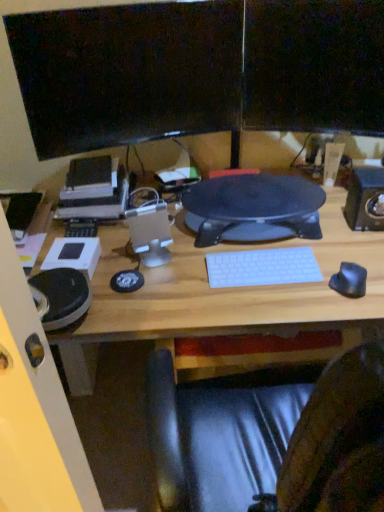
Question: Is black rubber mouse at right bigger than black textured mouse pad at center?

Choices:
 (A) yes
 (B) no

Answer: (B)

Question: Does black rubber mouse at right lie in front of black textured mouse pad at center?

Choices:
 (A) no
 (B) yes

Answer: (B)

Question: Is black rubber mouse at right further to the viewer compared to black textured mouse pad at center?

Choices:
 (A) no
 (B) yes

Answer: (A)

Question: Could you tell me if black rubber mouse at right is facing black textured mouse pad at center?

Choices:
 (A) no
 (B) yes

Answer: (A)

Question: Considering the relative sizes of black rubber mouse at right and black textured mouse pad at center in the image provided, is black rubber mouse at right shorter than black textured mouse pad at center?

Choices:
 (A) no
 (B) yes

Answer: (B)

Question: Considering the relative sizes of black rubber mouse at right and black textured mouse pad at center in the image provided, is black rubber mouse at right thinner than black textured mouse pad at center?

Choices:
 (A) yes
 (B) no

Answer: (A)

Question: Is black textured mouse pad at center further to camera compared to matte black monitor at upper center, the 1th computer monitor in the right-to-left sequence?

Choices:
 (A) no
 (B) yes

Answer: (B)

Question: Is black textured mouse pad at center next to matte black monitor at upper center, the second computer monitor when ordered from left to right, and touching it?

Choices:
 (A) no
 (B) yes

Answer: (A)

Question: Considering the relative positions of black textured mouse pad at center and matte black monitor at upper center, the second computer monitor when ordered from left to right, in the image provided, is black textured mouse pad at center to the left of matte black monitor at upper center, the second computer monitor when ordered from left to right, from the viewer's perspective?

Choices:
 (A) no
 (B) yes

Answer: (B)

Question: Is black textured mouse pad at center wider than matte black monitor at upper center, the 1th computer monitor in the right-to-left sequence?

Choices:
 (A) yes
 (B) no

Answer: (A)

Question: From the image's perspective, would you say black textured mouse pad at center is shown under matte black monitor at upper center, the second computer monitor when ordered from left to right?

Choices:
 (A) no
 (B) yes

Answer: (B)

Question: Does black textured mouse pad at center turn towards matte black monitor at upper center, the 1th computer monitor in the right-to-left sequence?

Choices:
 (A) no
 (B) yes

Answer: (A)

Question: From a real-world perspective, is white plastic keyboard at center beneath matte black monitor at upper center, the 1th computer monitor in the right-to-left sequence?

Choices:
 (A) no
 (B) yes

Answer: (B)